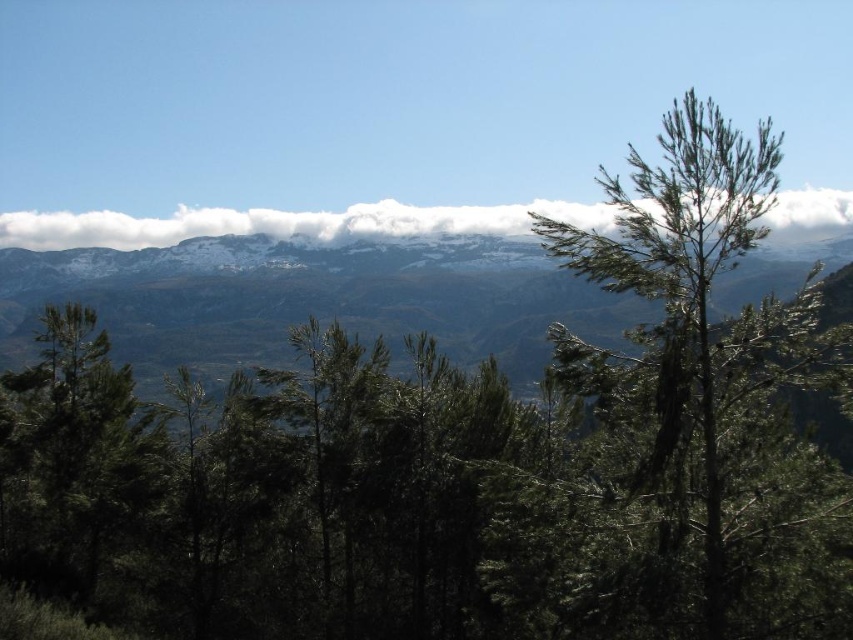
Where is `green needle-like tree at right`? The image size is (853, 640). green needle-like tree at right is located at coordinates (683, 257).

Can you confirm if green needle-like tree at right is taller than white fluffy cloud at upper center?

Indeed, green needle-like tree at right has a greater height compared to white fluffy cloud at upper center.

Locate an element on the screen. This screenshot has width=853, height=640. green needle-like tree at right is located at coordinates (683, 257).

Locate an element on the screen. Image resolution: width=853 pixels, height=640 pixels. green needle-like tree at right is located at coordinates (683, 257).